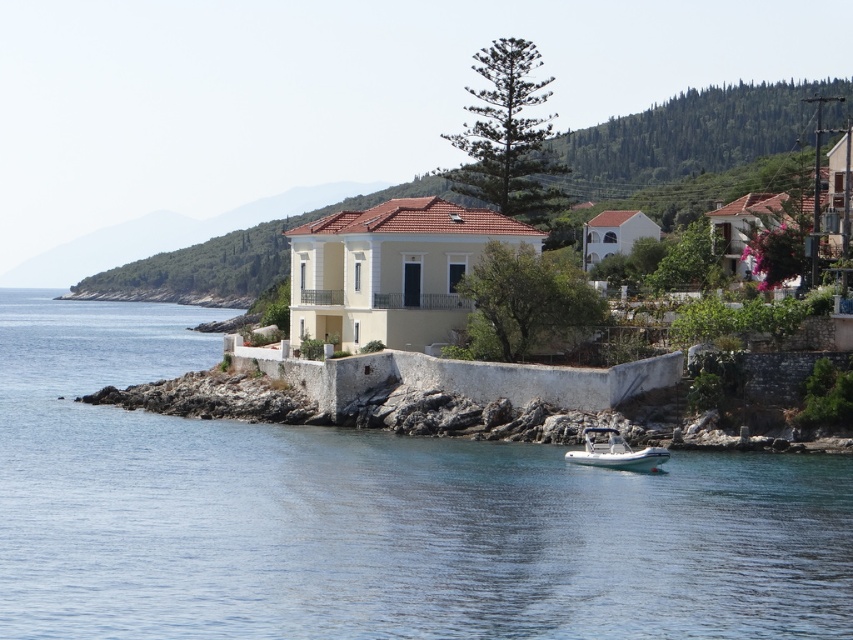
Question: Which of the following is the closest to the observer?

Choices:
 (A) green leafy hillside at upper center
 (B) clear blue water at center

Answer: (B)

Question: Is clear blue water at center to the left of green leafy hillside at upper center from the viewer's perspective?

Choices:
 (A) no
 (B) yes

Answer: (A)

Question: Which point appears farthest from the camera in this image?

Choices:
 (A) (701, 148)
 (B) (585, 461)

Answer: (A)

Question: Is clear blue water at center to the left of green leafy hillside at upper center from the viewer's perspective?

Choices:
 (A) no
 (B) yes

Answer: (A)

Question: Is green leafy hillside at upper center to the right of white rubber boat at lower center from the viewer's perspective?

Choices:
 (A) yes
 (B) no

Answer: (B)

Question: Among these points, which one is nearest to the camera?

Choices:
 (A) (622, 196)
 (B) (648, 509)

Answer: (B)